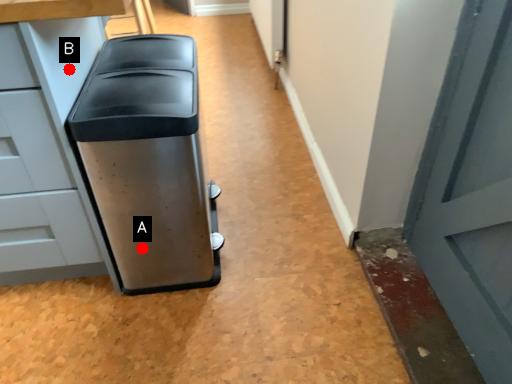
Question: Two points are circled on the image, labeled by A and B beside each circle. Which point is farther from the camera taking this photo?

Choices:
 (A) A is further
 (B) B is further

Answer: (A)